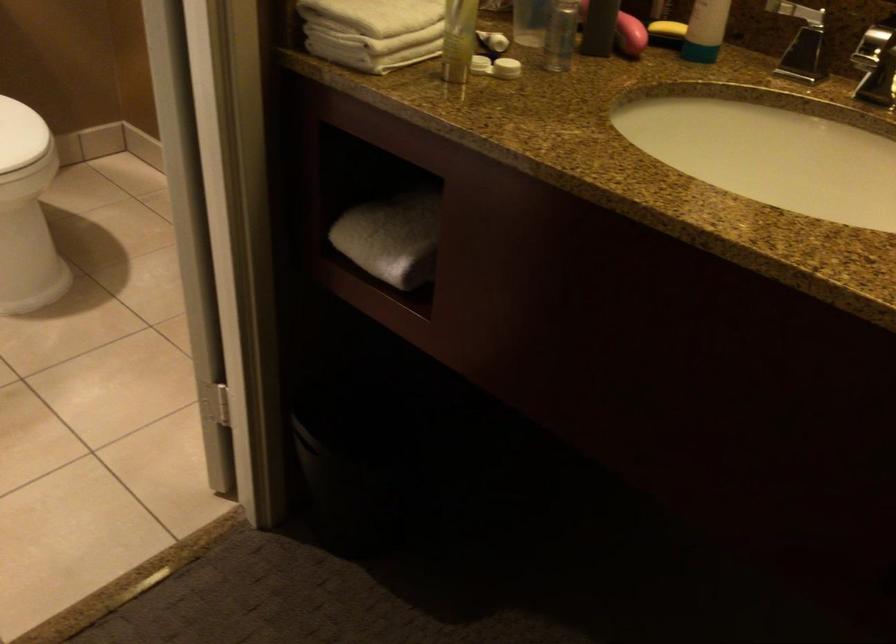
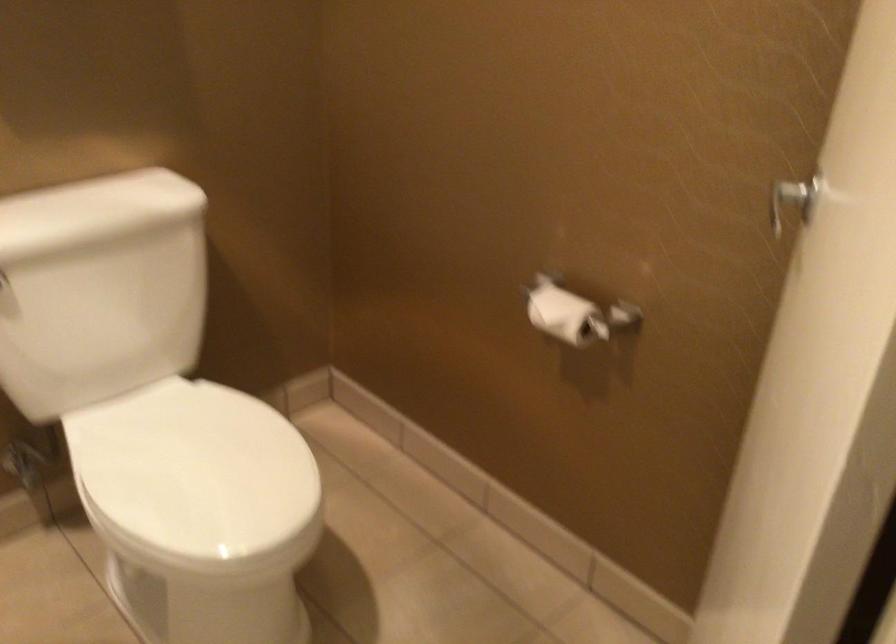
Question: The images are taken continuously from a first-person perspective. In which direction is your viewpoint rotating?

Choices:
 (A) Left
 (B) Right
 (C) Up
 (D) Down

Answer: (C)